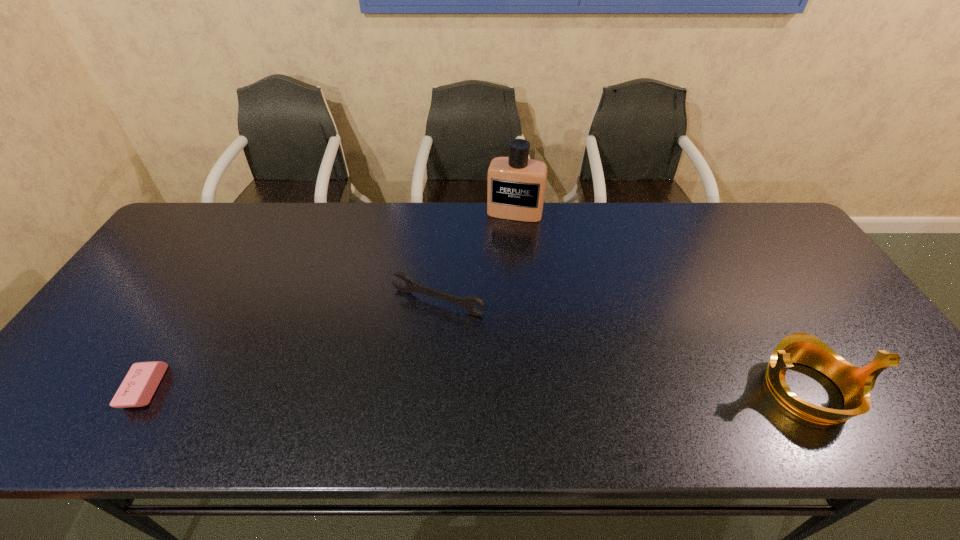
Identify the location of blank space located 0.210m on the open ends of the third nearest object. The height and width of the screenshot is (540, 960). [x=372, y=382].

Locate an element on the screen. This screenshot has width=960, height=540. free region located 0.150m on the open ends of the third nearest object is located at coordinates (387, 362).

I want to click on vacant region located 0.230m on the open ends of the third nearest object, so click(x=368, y=389).

Find the location of a particular element. Image resolution: width=960 pixels, height=540 pixels. vacant space located on the front label of the second object from right to left is located at coordinates (501, 259).

Identify the location of free location located on the front label of the second object from right to left. Image resolution: width=960 pixels, height=540 pixels. (493, 289).

Where is `free space located 0.290m on the front label of the second object from right to left`? The width and height of the screenshot is (960, 540). free space located 0.290m on the front label of the second object from right to left is located at coordinates (494, 285).

Find the location of a particular element. The image size is (960, 540). object at the far edge is located at coordinates (516, 185).

This screenshot has width=960, height=540. What are the coordinates of `eraser at the near edge` in the screenshot? It's located at (138, 387).

You are a GUI agent. You are given a task and a screenshot of the screen. Output one action in this format:
    pyautogui.click(x=<x>, y=<y>)
    Task: Click on the tiara that is at the near edge
    The width and height of the screenshot is (960, 540).
    Given the screenshot: What is the action you would take?
    pyautogui.click(x=855, y=383)

What are the coordinates of `object that is at the right edge` in the screenshot? It's located at pyautogui.click(x=855, y=383).